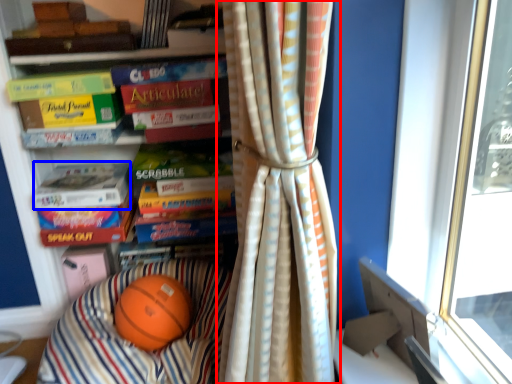
Question: Among these objects, which one is farthest to the camera, curtain (highlighted by a red box) or paperback book (highlighted by a blue box)?

Choices:
 (A) curtain
 (B) paperback book

Answer: (B)